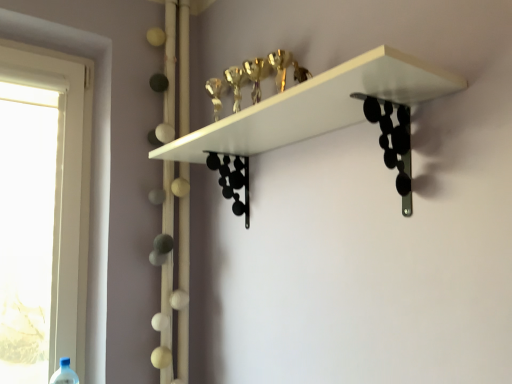
Question: Is blue plastic bottle at lower left inside or outside of white matte shelf at upper center?

Choices:
 (A) inside
 (B) outside

Answer: (B)

Question: In the image, is blue plastic bottle at lower left positioned in front of or behind white matte shelf at upper center?

Choices:
 (A) front
 (B) behind

Answer: (B)

Question: From the image's perspective, is blue plastic bottle at lower left above or below white matte shelf at upper center?

Choices:
 (A) above
 (B) below

Answer: (B)

Question: Is white matte shelf at upper center taller or shorter than blue plastic bottle at lower left?

Choices:
 (A) short
 (B) tall

Answer: (A)

Question: Is white matte shelf at upper center wider or thinner than blue plastic bottle at lower left?

Choices:
 (A) wide
 (B) thin

Answer: (A)

Question: Is white matte shelf at upper center inside or outside of blue plastic bottle at lower left?

Choices:
 (A) inside
 (B) outside

Answer: (B)

Question: Relative to blue plastic bottle at lower left, is white matte shelf at upper center in front or behind?

Choices:
 (A) behind
 (B) front

Answer: (B)